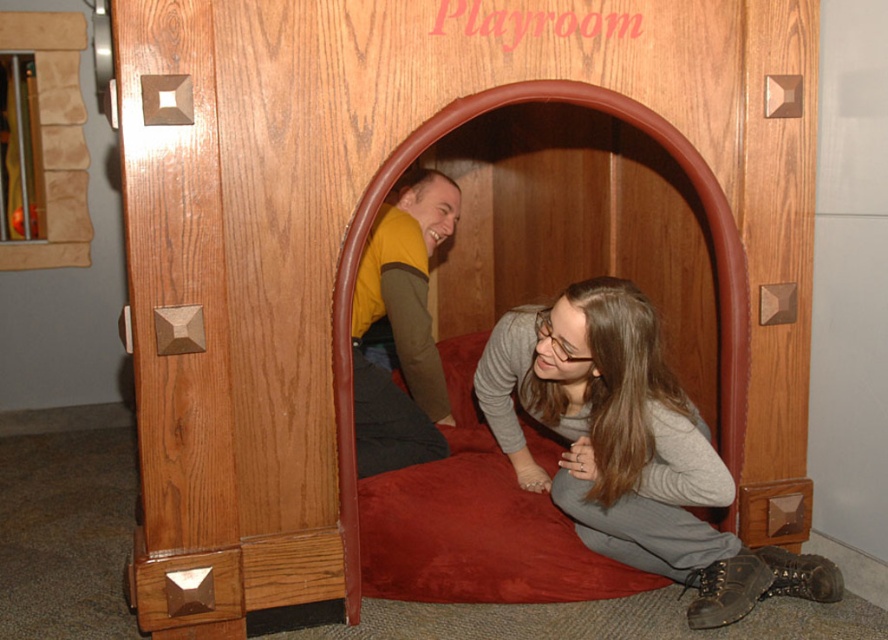
Describe the element at coordinates (629, 449) in the screenshot. I see `gray fabric pants at lower right` at that location.

Is the position of gray fabric pants at lower right less distant than that of yellow-green shirt at center?

Yes.

Is point (611, 328) positioned after point (422, 232)?

No.

Identify the location of gray fabric pants at lower right. The image size is (888, 640). (629, 449).